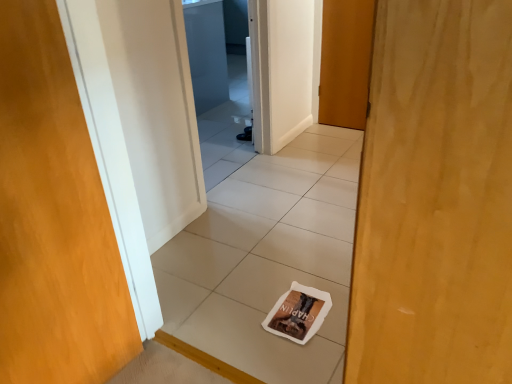
Question: From the image's perspective, is white tile at center located above or below wooden door at center, placed as the 2th door when sorted from left to right?

Choices:
 (A) above
 (B) below

Answer: (B)

Question: In terms of size, does white tile at center appear bigger or smaller than wooden door at center, placed as the 2th door when sorted from left to right?

Choices:
 (A) small
 (B) big

Answer: (B)

Question: Estimate the real-world distances between objects in this image. Which object is farther from the transparent glass screen door at upper center?

Choices:
 (A) brown paper magazine at center
 (B) white tile at center
 (C) wooden door at center, which is the 1th door in back-to-front order
 (D) wooden door at left, which is counted as the 2th door, starting from the back

Answer: (D)

Question: Estimate the real-world distances between objects in this image. Which object is farther from the brown paper magazine at center?

Choices:
 (A) white tile at center
 (B) wooden door at center, marked as the first door in a right-to-left arrangement
 (C) transparent glass screen door at upper center
 (D) wooden door at left, the first door when ordered from left to right

Answer: (C)